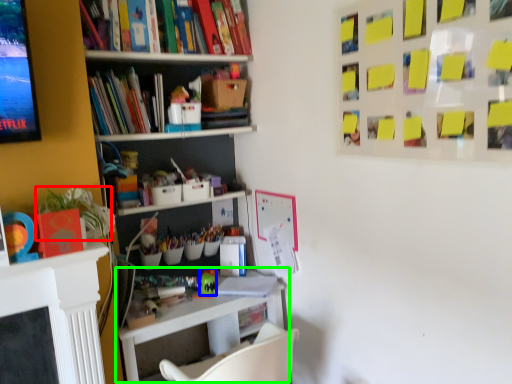
Question: Which object is the closest to the plant (highlighted by a red box)? Choose among these: toy (highlighted by a blue box) or table (highlighted by a green box).

Choices:
 (A) toy
 (B) table

Answer: (B)